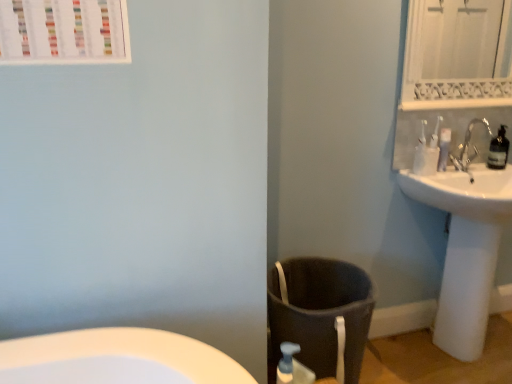
The width and height of the screenshot is (512, 384). Identify the location of free spot below white glossy sink at right (from a real-world perspective). (472, 355).